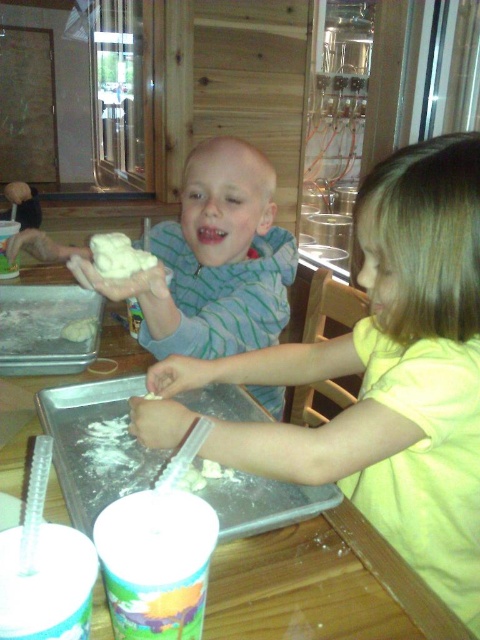
Does white dough at upper center appear over white flour at center?

Indeed, white dough at upper center is positioned over white flour at center.

Is white dough at upper center to the right of white flour at center from the viewer's perspective?

Correct, you'll find white dough at upper center to the right of white flour at center.

Which is in front, point (155, 257) or point (87, 337)?

Point (155, 257)

Locate an element on the screen. white dough at upper center is located at coordinates (118, 256).

Is the position of smooth white dough at center less distant than that of white dough at upper center?

Yes, it is.

Can you confirm if smooth white dough at center is smaller than white dough at upper center?

Incorrect, smooth white dough at center is not smaller in size than white dough at upper center.

Image resolution: width=480 pixels, height=640 pixels. Describe the element at coordinates (381, 376) in the screenshot. I see `smooth white dough at center` at that location.

What are the coordinates of `smooth white dough at center` in the screenshot? It's located at (381, 376).

What do you see at coordinates (80, 330) in the screenshot? The width and height of the screenshot is (480, 640). I see `white flour at center` at bounding box center [80, 330].

Does point (75, 340) come closer to viewer compared to point (149, 400)?

No, (75, 340) is behind (149, 400).

Does point (93, 320) come closer to viewer compared to point (146, 397)?

No, (93, 320) is further to viewer.

Where is `white flour at center`? The width and height of the screenshot is (480, 640). white flour at center is located at coordinates (80, 330).